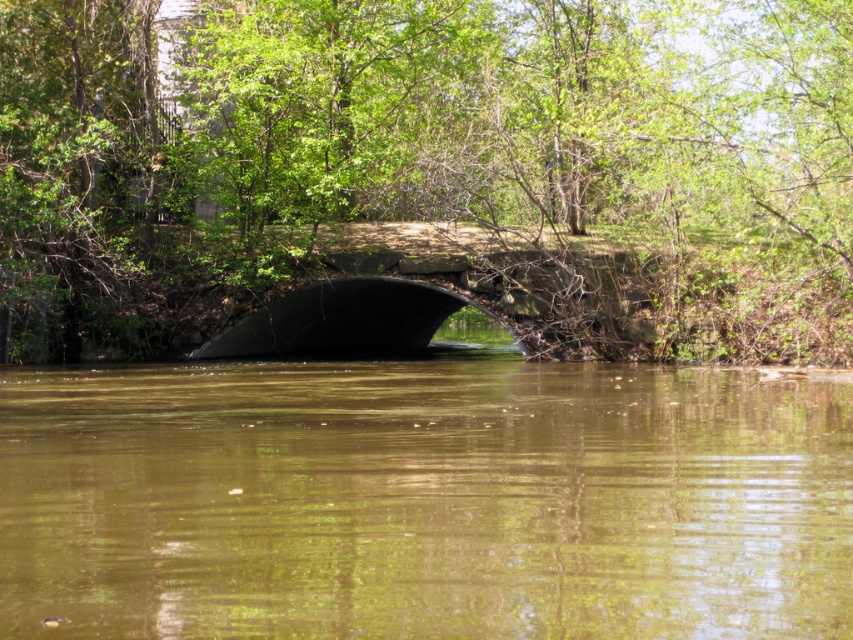
Which is behind, point (323, 460) or point (396, 333)?

Positioned behind is point (396, 333).

Which is above, brown matte water at center or black rubber bridge at center?

black rubber bridge at center

What do you see at coordinates (422, 500) in the screenshot? Image resolution: width=853 pixels, height=640 pixels. I see `brown matte water at center` at bounding box center [422, 500].

Where is `brown matte water at center`? brown matte water at center is located at coordinates (422, 500).

Can you confirm if green leafy tree at center is shorter than black rubber bridge at center?

Incorrect, green leafy tree at center's height does not fall short of black rubber bridge at center's.

Between point (726, 298) and point (444, 317), which one is positioned behind?

The point (444, 317) is behind.

You are a GUI agent. You are given a task and a screenshot of the screen. Output one action in this format:
    pyautogui.click(x=<x>, y=<y>)
    Task: Click on the green leafy tree at center
    The image size is (853, 640).
    Given the screenshot: What is the action you would take?
    pyautogui.click(x=430, y=170)

Can you confirm if green leafy tree at center is positioned below brown matte water at center?

No, green leafy tree at center is not below brown matte water at center.

Consider the image. Who is more forward, (160, 134) or (57, 404)?

Point (57, 404)

Is point (361, 148) closer to camera compared to point (102, 563)?

That is False.

Find the location of a particular element. green leafy tree at center is located at coordinates (430, 170).